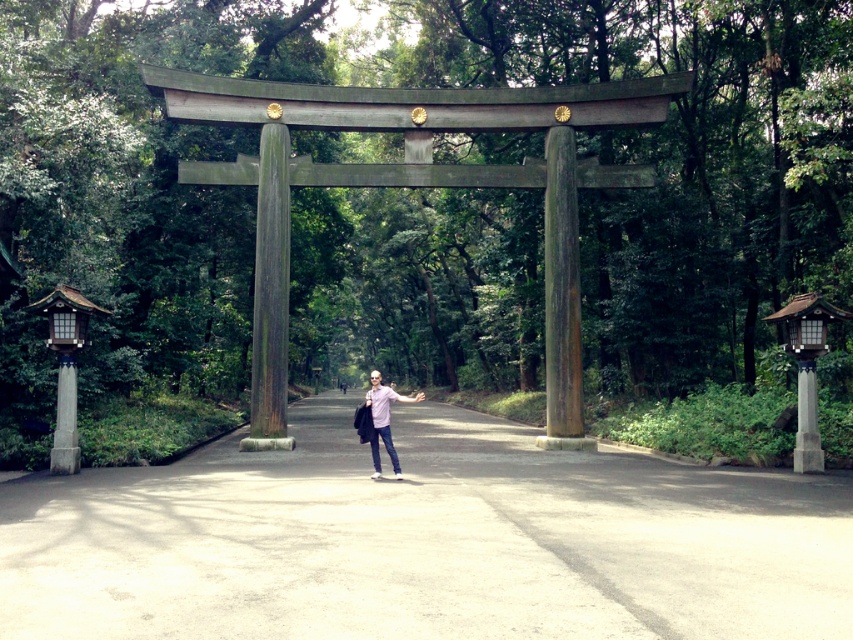
Question: Can you confirm if rusty wood pillar at center is positioned below pink cotton shirt at center?

Choices:
 (A) yes
 (B) no

Answer: (B)

Question: Among these points, which one is nearest to the camera?

Choices:
 (A) (277, 381)
 (B) (393, 460)

Answer: (B)

Question: Which point is closer to the camera?

Choices:
 (A) pink cotton shirt at center
 (B) weathered wood pillar at center
 (C) smooth concrete path at center

Answer: (C)

Question: Which object is closer to the camera taking this photo?

Choices:
 (A) smooth concrete path at center
 (B) rusty wood pillar at center
 (C) pink cotton shirt at center

Answer: (A)

Question: Does rusty wood pillar at center appear under pink cotton shirt at center?

Choices:
 (A) no
 (B) yes

Answer: (A)

Question: Is smooth concrete path at center wider than pink cotton shirt at center?

Choices:
 (A) no
 (B) yes

Answer: (B)